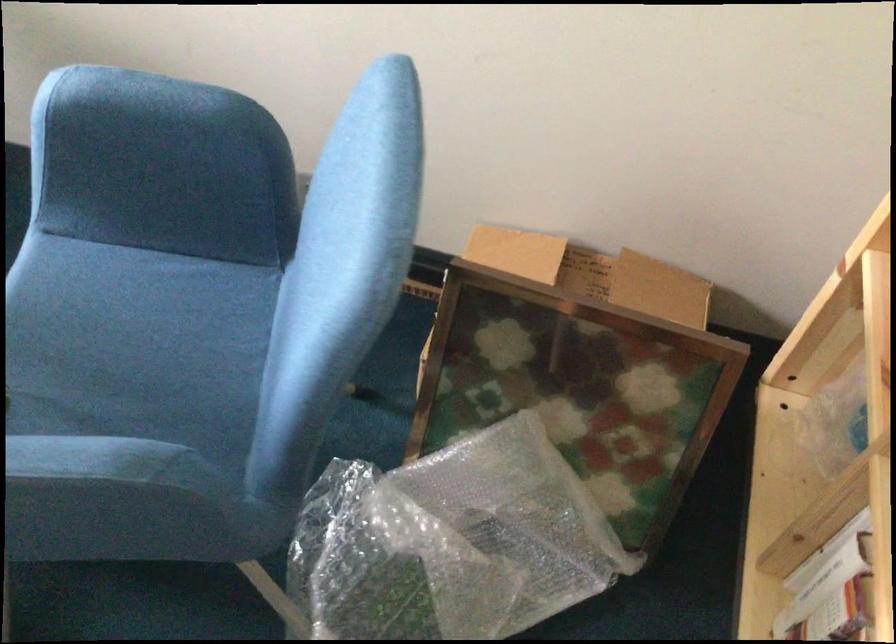
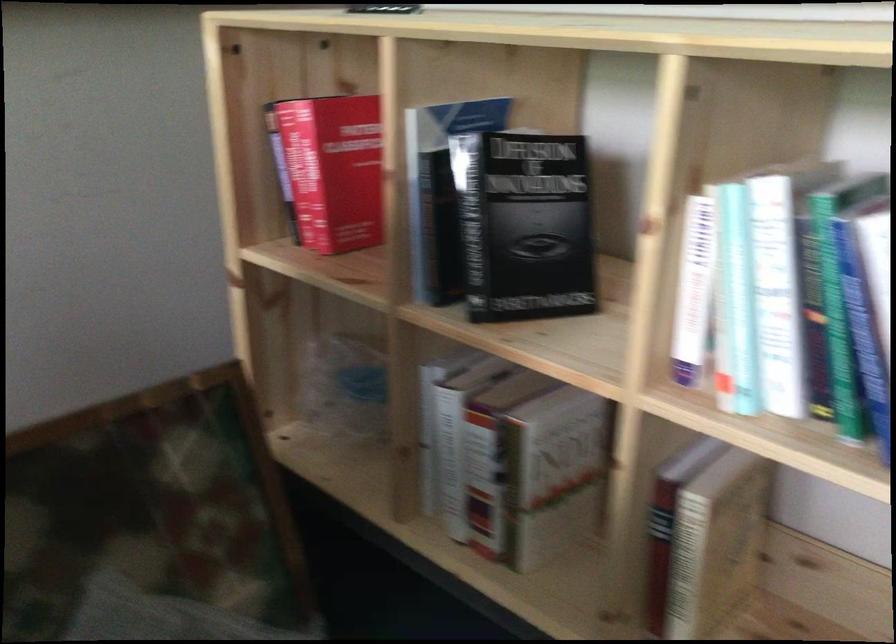
Question: The camera is either moving clockwise (left) or counter-clockwise (right) around the object. The first image is from the beginning of the video and the second image is from the end. Is the camera moving left or right when shooting the video?

Choices:
 (A) Left
 (B) Right

Answer: (A)